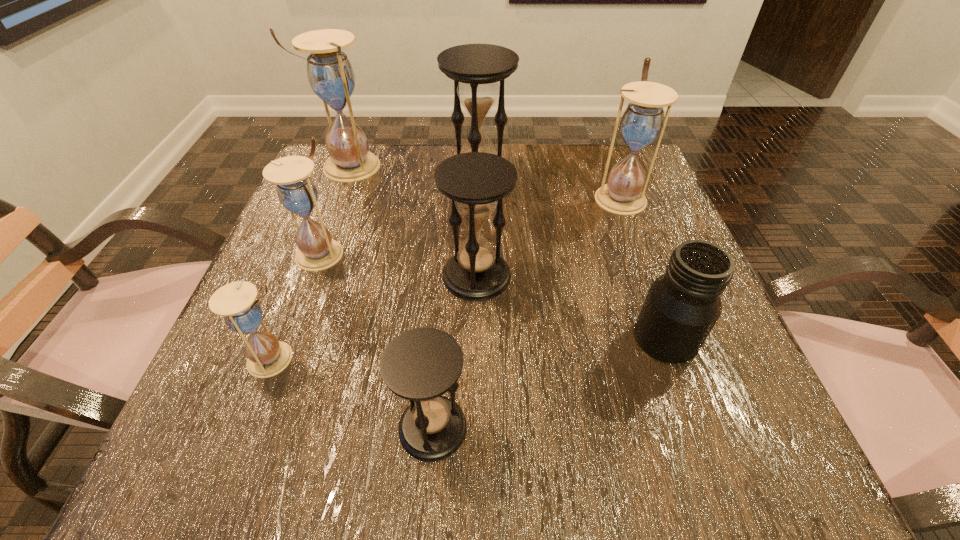
The width and height of the screenshot is (960, 540). Identify the location of the nearest black hourglass. (421, 364).

Locate an element on the screen. This screenshot has width=960, height=540. the nearest object is located at coordinates (421, 364).

At what (x,y) coordinates should I click in order to perform the action: click on vacant space located on the right of the tallest hourglass. Please return your answer as a coordinate pair (x, y). This screenshot has height=540, width=960. Looking at the image, I should click on (409, 167).

The width and height of the screenshot is (960, 540). I want to click on free space located on the left of the biggest black hourglass, so click(353, 180).

I want to click on vacant space positioned on the left of the rightmost hourglass, so click(463, 196).

The height and width of the screenshot is (540, 960). In order to click on blank space located on the left of the second smallest black hourglass in this screenshot , I will do `click(354, 276)`.

Locate an element on the screen. The width and height of the screenshot is (960, 540). free space located on the right of the second nearest white hourglass is located at coordinates (421, 252).

Image resolution: width=960 pixels, height=540 pixels. Identify the location of vacant area situated on the left of the jar. (553, 338).

I want to click on vacant space located 0.380m on the right of the nearest white hourglass, so click(547, 359).

At what (x,y) coordinates should I click in order to perform the action: click on vacant space located 0.100m on the right of the nearest hourglass. Please return your answer as a coordinate pair (x, y). The height and width of the screenshot is (540, 960). Looking at the image, I should click on (540, 428).